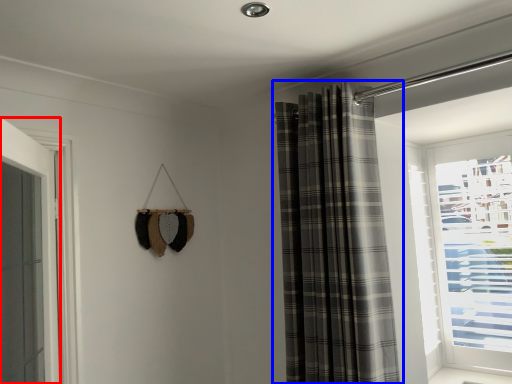
Question: Which of the following is the farthest to the observer, door (highlighted by a red box) or curtain (highlighted by a blue box)?

Choices:
 (A) door
 (B) curtain

Answer: (B)